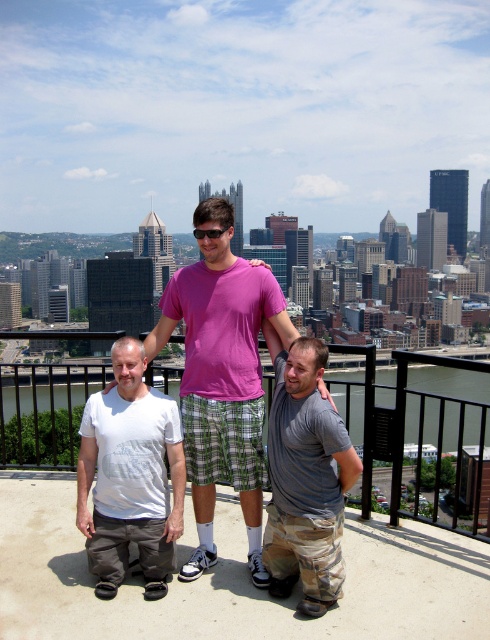
You are standing on the observation deck and want to walk from the point closer to the railing to the point further away from the railing. Which path should you take between the two points, point [229,451] and point [310,424]?

You should walk towards point [310,424] because it is further away from the railing compared to point [229,451], which is closer.